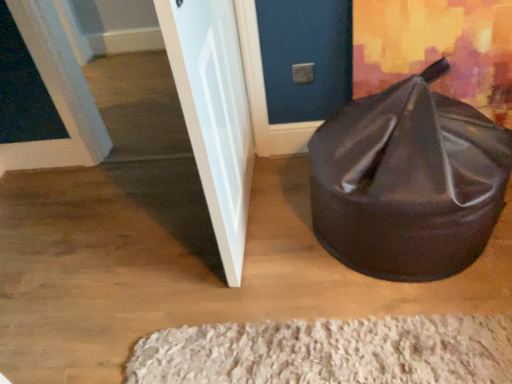
Question: Considering the relative sizes of white shaggy rug at lower center and white glossy door at left, the second door from the left, in the image provided, is white shaggy rug at lower center wider than white glossy door at left, the second door from the left,?

Choices:
 (A) yes
 (B) no

Answer: (A)

Question: Considering the relative positions of white shaggy rug at lower center and white glossy door at left, which is the 1th door in right-to-left order, in the image provided, is white shaggy rug at lower center to the right of white glossy door at left, which is the 1th door in right-to-left order, from the viewer's perspective?

Choices:
 (A) yes
 (B) no

Answer: (A)

Question: From the image's perspective, does white shaggy rug at lower center appear lower than white glossy door at left, the second door from the left?

Choices:
 (A) no
 (B) yes

Answer: (B)

Question: Can you confirm if white shaggy rug at lower center is bigger than white glossy door at left, which is the 1th door in right-to-left order?

Choices:
 (A) yes
 (B) no

Answer: (B)

Question: Is white shaggy rug at lower center positioned with its back to white glossy door at left, which is the 1th door in right-to-left order?

Choices:
 (A) no
 (B) yes

Answer: (A)

Question: Does white shaggy rug at lower center have a greater height compared to white glossy door at left, which is the 1th door in right-to-left order?

Choices:
 (A) yes
 (B) no

Answer: (B)

Question: From a real-world perspective, is white shaggy rug at lower center over white painted wood door at upper left, which ranks as the first door in left-to-right order?

Choices:
 (A) yes
 (B) no

Answer: (B)

Question: Does white shaggy rug at lower center appear on the right side of white painted wood door at upper left, which appears as the second door when viewed from the right?

Choices:
 (A) yes
 (B) no

Answer: (A)

Question: Is white shaggy rug at lower center smaller than white painted wood door at upper left, which appears as the second door when viewed from the right?

Choices:
 (A) yes
 (B) no

Answer: (A)

Question: From a real-world perspective, is white shaggy rug at lower center physically below white painted wood door at upper left, which appears as the second door when viewed from the right?

Choices:
 (A) no
 (B) yes

Answer: (B)

Question: Considering the relative sizes of white shaggy rug at lower center and white painted wood door at upper left, which ranks as the first door in left-to-right order, in the image provided, is white shaggy rug at lower center shorter than white painted wood door at upper left, which ranks as the first door in left-to-right order,?

Choices:
 (A) yes
 (B) no

Answer: (A)

Question: Is white shaggy rug at lower center not within white painted wood door at upper left, which appears as the second door when viewed from the right?

Choices:
 (A) yes
 (B) no

Answer: (A)

Question: Does white glossy door at left, which is the 1th door in right-to-left order, contain white shaggy rug at lower center?

Choices:
 (A) yes
 (B) no

Answer: (B)